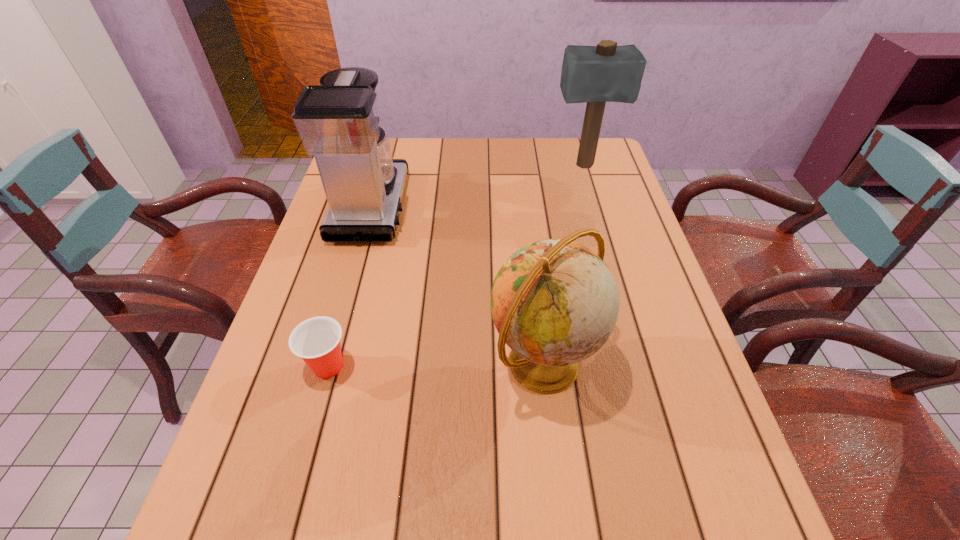
You are a GUI agent. You are given a task and a screenshot of the screen. Output one action in this format:
    pyautogui.click(x=<x>, y=<y>)
    Task: Click on the free location that satisfies the following two spatial constraints: 1. on the back side of the cup; 2. at the front of the coffee maker where the controls are located
    The width and height of the screenshot is (960, 540).
    Given the screenshot: What is the action you would take?
    pyautogui.click(x=372, y=207)

Identify the location of free space that satisfies the following two spatial constraints: 1. at the front of the globe where the controls are located; 2. on the left side of the coffee maker. (327, 365).

This screenshot has width=960, height=540. I want to click on vacant area in the image that satisfies the following two spatial constraints: 1. on the back side of the shortest object; 2. at the front of the coffee maker where the controls are located, so click(x=372, y=207).

I want to click on free space that satisfies the following two spatial constraints: 1. on the back side of the mallet; 2. on the right side of the globe, so click(519, 166).

What are the coordinates of `free location that satisfies the following two spatial constraints: 1. at the front of the coffee maker where the controls are located; 2. on the left side of the globe` in the screenshot? It's located at (327, 365).

What are the coordinates of `vacant region that satisfies the following two spatial constraints: 1. at the front of the shortest object where the controls are located; 2. on the left side of the coffee maker` in the screenshot? It's located at (326, 366).

At what (x,y) coordinates should I click in order to perform the action: click on free space that satisfies the following two spatial constraints: 1. on the back side of the mallet; 2. on the left side of the globe. Please return your answer as a coordinate pair (x, y). This screenshot has width=960, height=540. Looking at the image, I should click on (519, 166).

Locate an element on the screen. vacant space that satisfies the following two spatial constraints: 1. at the front of the cup where the controls are located; 2. on the left side of the coffee maker is located at coordinates (326, 366).